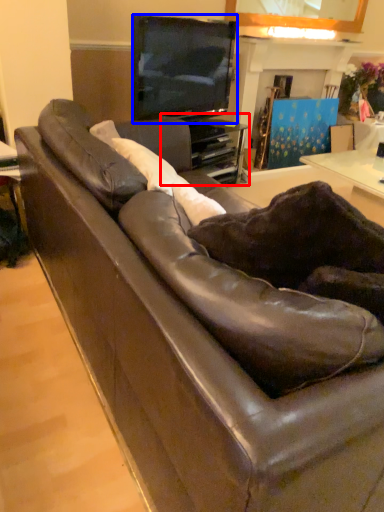
Question: Which point is further to the camera, entertainment center (highlighted by a red box) or television (highlighted by a blue box)?

Choices:
 (A) entertainment center
 (B) television

Answer: (A)